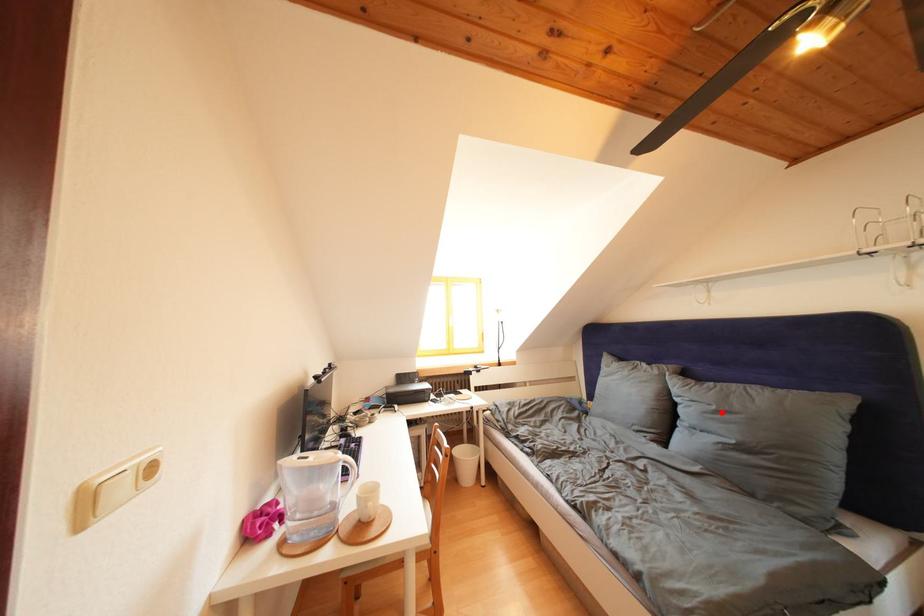
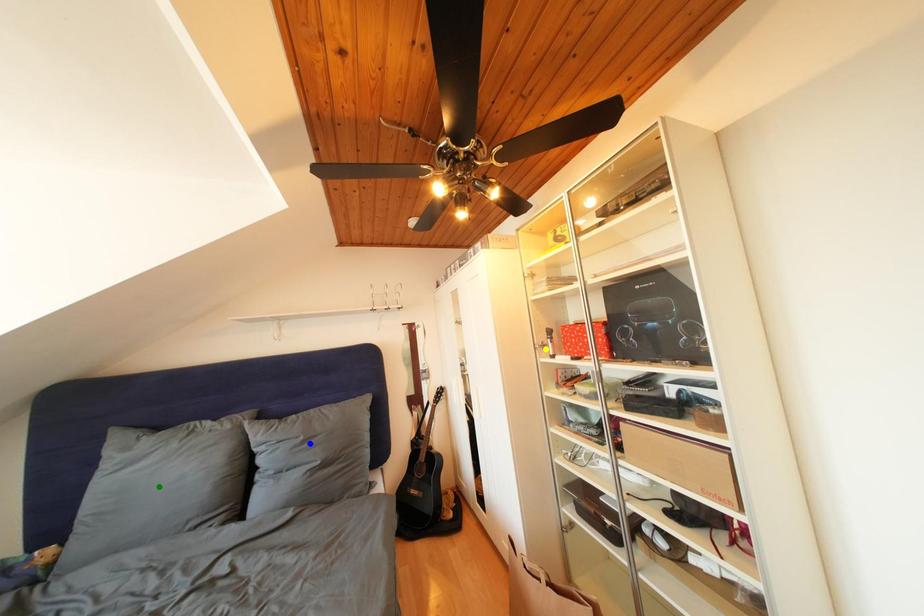
Question: I am providing you with two images of the same scene from different viewpoints. A red point is marked on the first image. You are given multiple points on the second image. Which spot in image 2 lines up with the point in image 1?

Choices:
 (A) green point
 (B) yellow point
 (C) blue point

Answer: (C)